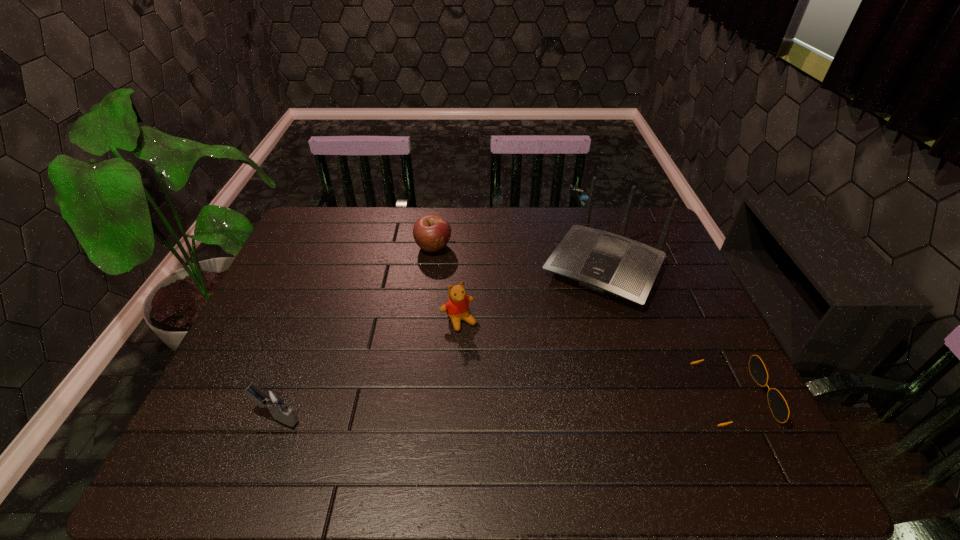
This screenshot has height=540, width=960. What are the coordinates of `vacant space on the desktop that is between the leftmost object and the shortest object and is positioned on the side of the fourth tallest object with the unique marking` in the screenshot? It's located at (454, 409).

Identify the location of vacant space on the desktop that is between the igniter and the shortest object and is positioned on the front-facing side of the tallest object. (521, 406).

Locate an element on the screen. vacant space on the desktop that is between the leftmost object and the shortest object and is positioned on the front-facing side of the teddy bear is located at coordinates (513, 406).